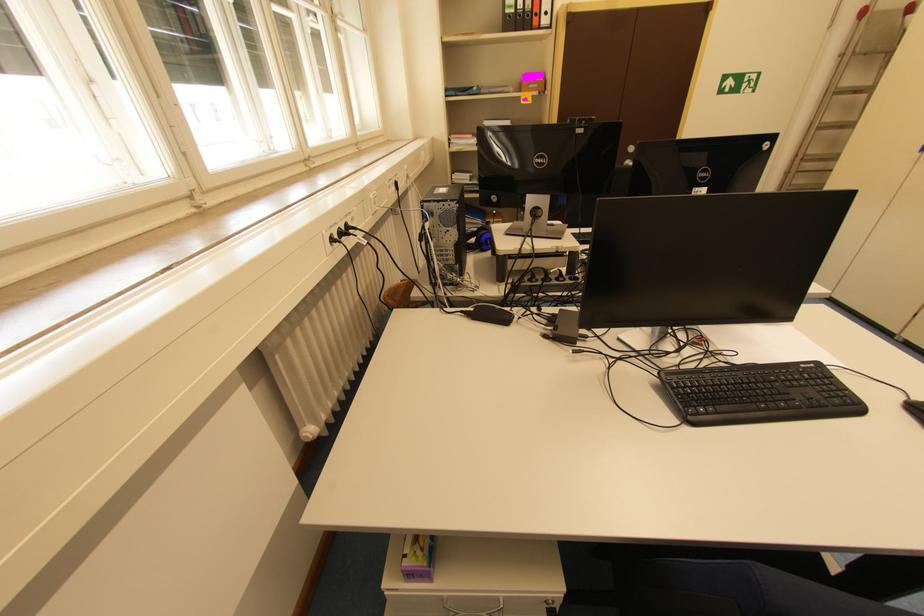
At what (x,y) coordinates should I click in order to perform the action: click on pink sticky notes. Please return your answer as a coordinate pair (x, y). The image size is (924, 616). Looking at the image, I should click on (x=530, y=84).